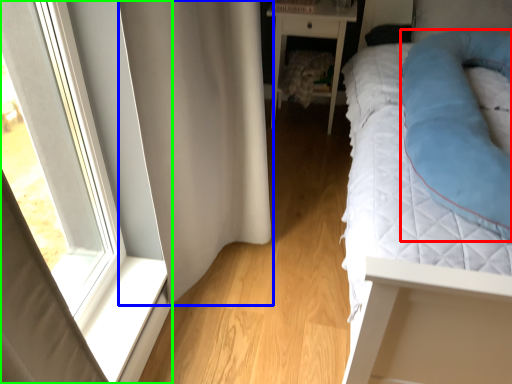
Question: Considering the real-world distances, which object is farthest from cat bed (highlighted by a red box)? curtain (highlighted by a blue box) or window (highlighted by a green box)?

Choices:
 (A) curtain
 (B) window

Answer: (B)